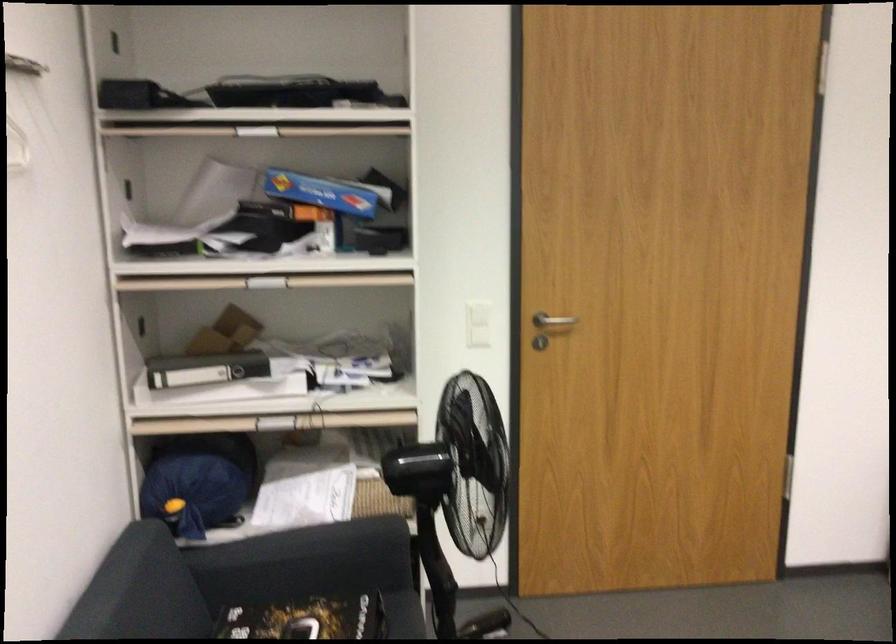
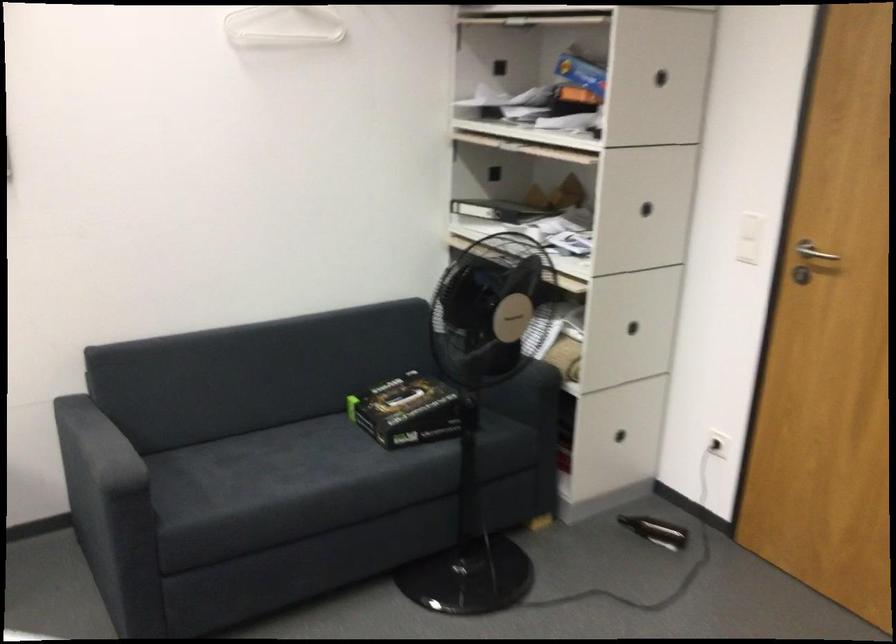
The point at [480,330] is marked in the first image. Where is the corresponding point in the second image?

(748, 238)